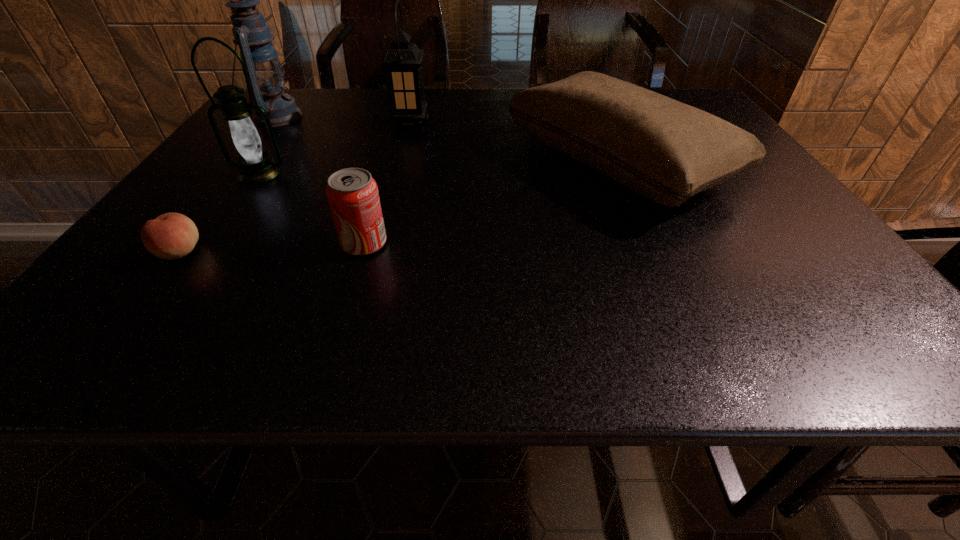
The width and height of the screenshot is (960, 540). Find the location of `the rightmost lantern`. the rightmost lantern is located at coordinates (402, 62).

Where is `the nearest lantern`? Image resolution: width=960 pixels, height=540 pixels. the nearest lantern is located at coordinates (255, 166).

Image resolution: width=960 pixels, height=540 pixels. I want to click on cushion, so click(x=664, y=150).

This screenshot has height=540, width=960. I want to click on soda can, so click(x=353, y=197).

Where is `the shortest object`? The width and height of the screenshot is (960, 540). the shortest object is located at coordinates (170, 236).

Identify the location of free region located 0.330m on the right of the rightmost lantern. (548, 123).

Identify the location of vacant space located 0.400m on the side where the nearest lantern emits light. The image size is (960, 540). (159, 319).

I want to click on vacant point located 0.070m on the right of the cushion, so click(x=755, y=163).

I want to click on free location located on the right of the soda can, so click(554, 244).

In order to click on free region located on the left of the peach in this screenshot , I will do `click(131, 252)`.